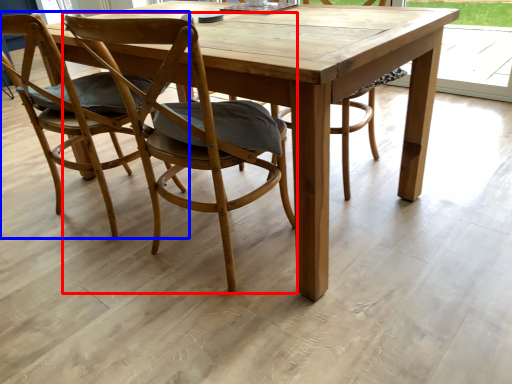
Question: Among these objects, which one is farthest to the camera, chair (highlighted by a red box) or chair (highlighted by a blue box)?

Choices:
 (A) chair
 (B) chair

Answer: (B)